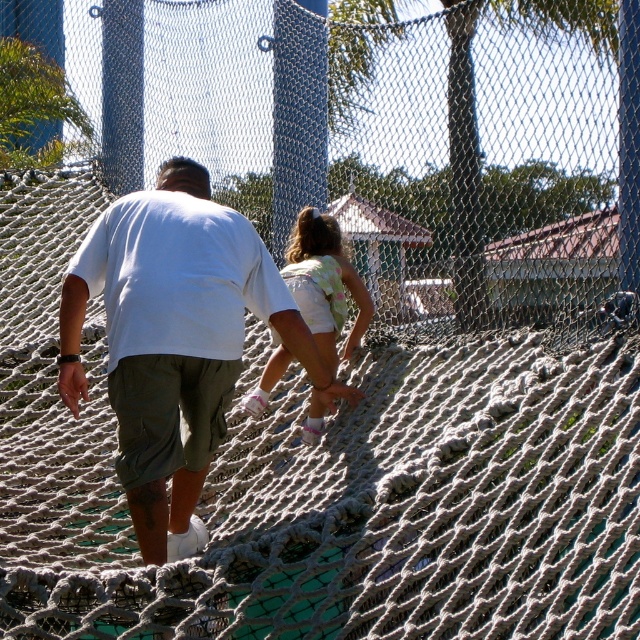
Does white cotton shirt at center have a greater height compared to light pink fabric dress at center?

Yes, white cotton shirt at center is taller than light pink fabric dress at center.

Between point (83, 372) and point (321, 216), which one is positioned behind?

Point (321, 216)

Where is `white cotton shirt at center`? The image size is (640, 640). white cotton shirt at center is located at coordinates (176, 340).

Find the location of `white cotton shirt at center`. white cotton shirt at center is located at coordinates (176, 340).